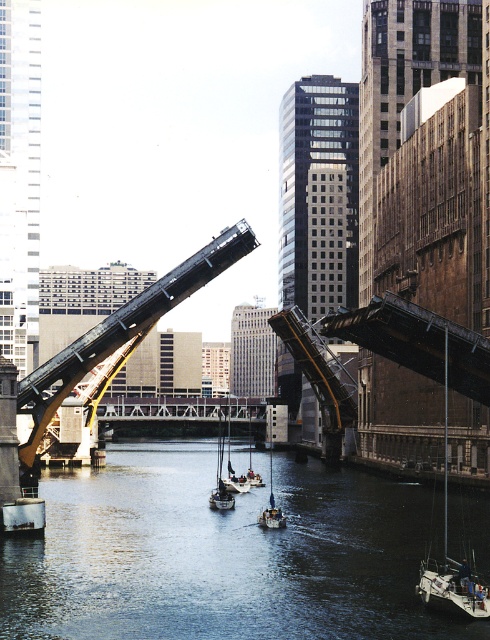
You are a photographer standing on the riverbank and want to take a photo of both the metallic gray boat at center and the white wooden sailboat at center. Which boat will appear larger in your photo?

The metallic gray boat at center will appear larger in the photo because it is closer to the viewer than the white wooden sailboat at center.